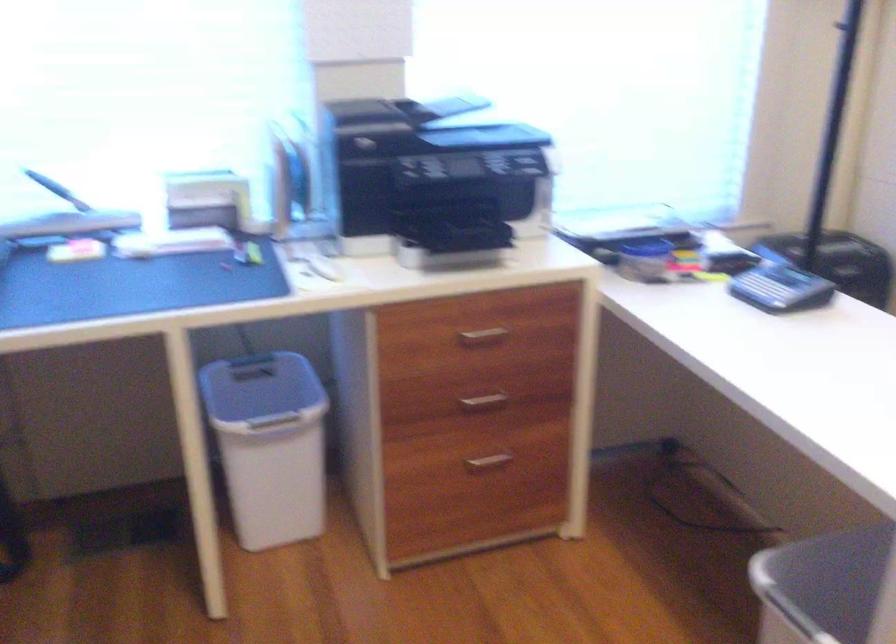
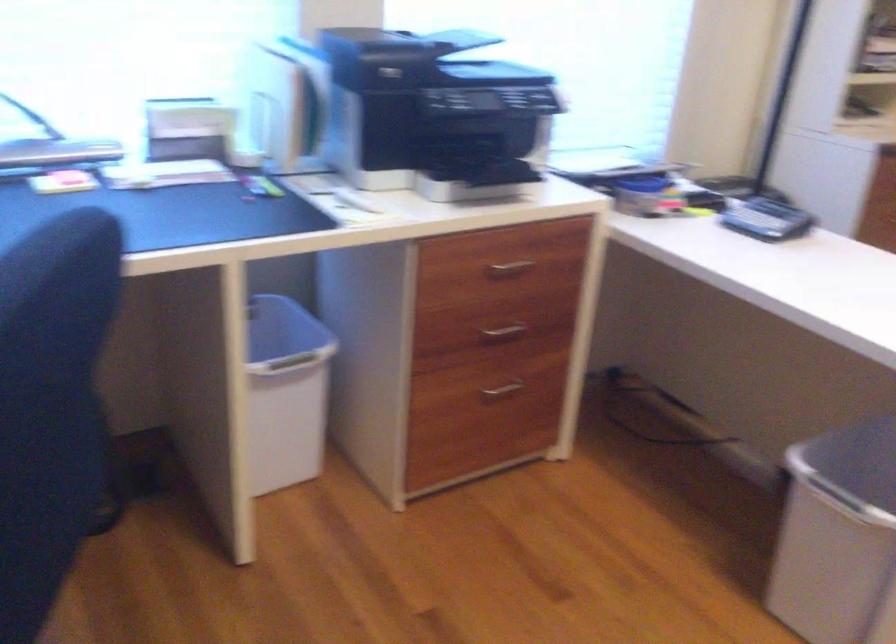
Question: How did the camera likely rotate?

Choices:
 (A) Left
 (B) Right
 (C) Up
 (D) Down

Answer: (B)